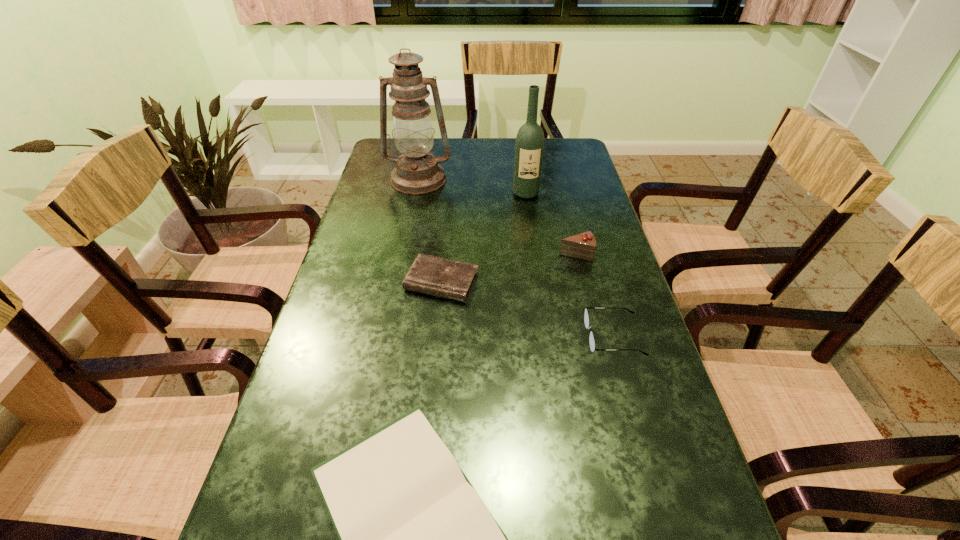
At what (x,y) coordinates should I click in order to perform the action: click on the tallest object. Please return your answer as a coordinate pair (x, y). This screenshot has height=540, width=960. Looking at the image, I should click on (417, 171).

Where is `the fourth object from left to right`? The image size is (960, 540). the fourth object from left to right is located at coordinates (529, 147).

The width and height of the screenshot is (960, 540). I want to click on wine bottle, so click(x=529, y=147).

Locate an element on the screen. The width and height of the screenshot is (960, 540). the third tallest object is located at coordinates (582, 246).

At what (x,y) coordinates should I click in order to perform the action: click on chocolate cake. Please return your answer as a coordinate pair (x, y). This screenshot has width=960, height=540. Looking at the image, I should click on (582, 246).

The width and height of the screenshot is (960, 540). I want to click on spectacles, so click(586, 317).

Where is `the third shortest object`? the third shortest object is located at coordinates (586, 317).

Identify the location of the fourth farthest object. Image resolution: width=960 pixels, height=540 pixels. (431, 275).

Find the location of `free region located on the right of the oil lamp`. free region located on the right of the oil lamp is located at coordinates (473, 180).

This screenshot has height=540, width=960. I want to click on vacant space located on the labeled side of the wine bottle, so pos(538,277).